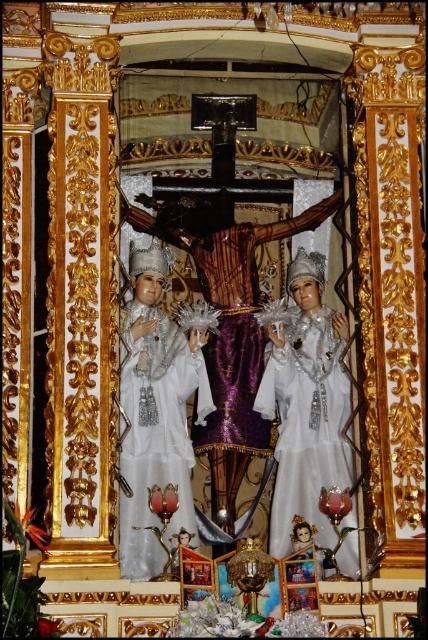
Who is more forward, (x=130, y=364) or (x=351, y=481)?

Point (x=351, y=481) is in front.

Can you confirm if white glossy statue at center is bigger than white satin dress at center?

Yes, white glossy statue at center is bigger than white satin dress at center.

Does point (180, 477) lie behind point (291, 438)?

No, (180, 477) is in front of (291, 438).

Locate an element on the screen. white glossy statue at center is located at coordinates (155, 413).